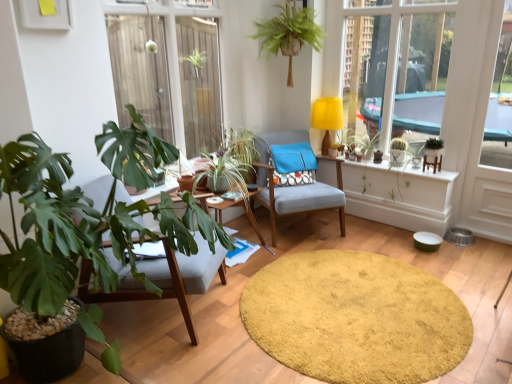
Question: Should I look upward or downward to see green matte cactus at upper right, which appears as the first plant when viewed from the right?

Choices:
 (A) down
 (B) up

Answer: (B)

Question: Can you confirm if transparent glass window at upper left is taller than green matte cactus at upper right, which appears as the 2th plant when viewed from the left?

Choices:
 (A) yes
 (B) no

Answer: (A)

Question: Is green matte cactus at upper right, which appears as the first plant when viewed from the right, surrounded by transparent glass window at upper left?

Choices:
 (A) yes
 (B) no

Answer: (B)

Question: Is transparent glass window at upper left shorter than green matte cactus at upper right, which appears as the 2th plant when viewed from the left?

Choices:
 (A) yes
 (B) no

Answer: (B)

Question: Is transparent glass window at upper left positioned with its back to green matte cactus at upper right, which appears as the first plant when viewed from the right?

Choices:
 (A) no
 (B) yes

Answer: (A)

Question: Is transparent glass window at upper left at the left side of green matte cactus at upper right, which appears as the first plant when viewed from the right?

Choices:
 (A) no
 (B) yes

Answer: (B)

Question: Considering the relative sizes of transparent glass window at upper left and green matte cactus at upper right, which appears as the first plant when viewed from the right, in the image provided, is transparent glass window at upper left wider than green matte cactus at upper right, which appears as the first plant when viewed from the right,?

Choices:
 (A) yes
 (B) no

Answer: (B)

Question: From a real-world perspective, is green matte cactus at upper right, the 5th houseplant viewed from the front, on top of green leafy plant at upper center, the 3th houseplant in the left-to-right sequence?

Choices:
 (A) no
 (B) yes

Answer: (A)

Question: Is green matte cactus at upper right, positioned as the 4th houseplant in left-to-right order, taller than green leafy plant at upper center, positioned as the 4th houseplant in back-to-front order?

Choices:
 (A) yes
 (B) no

Answer: (B)

Question: Does green matte cactus at upper right, positioned as the 4th houseplant in left-to-right order, turn towards green leafy plant at upper center, positioned as the 4th houseplant in back-to-front order?

Choices:
 (A) yes
 (B) no

Answer: (B)

Question: From the image's perspective, is green matte cactus at upper right, positioned as the 4th houseplant in left-to-right order, located beneath green leafy plant at upper center, which is the third houseplant from right to left?

Choices:
 (A) no
 (B) yes

Answer: (B)

Question: Is the position of green matte cactus at upper right, the 5th houseplant viewed from the front, less distant than that of green leafy plant at upper center, positioned as the 4th houseplant in back-to-front order?

Choices:
 (A) no
 (B) yes

Answer: (A)

Question: Can you confirm if green matte cactus at upper right, positioned as the 4th houseplant in left-to-right order, is shorter than green leafy plant at upper center, which is the third houseplant from right to left?

Choices:
 (A) yes
 (B) no

Answer: (A)

Question: Would you consider green leafy plant at upper center, which is the third houseplant from right to left, to be distant from matte gray chair at left, arranged as the first chair when viewed from the front?

Choices:
 (A) yes
 (B) no

Answer: (A)